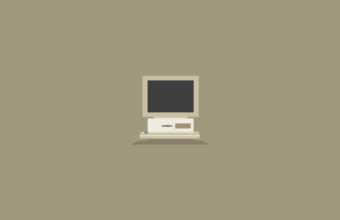
Where is `edges of computer screen`? edges of computer screen is located at coordinates (198, 112), (197, 75), (143, 75), (145, 114).